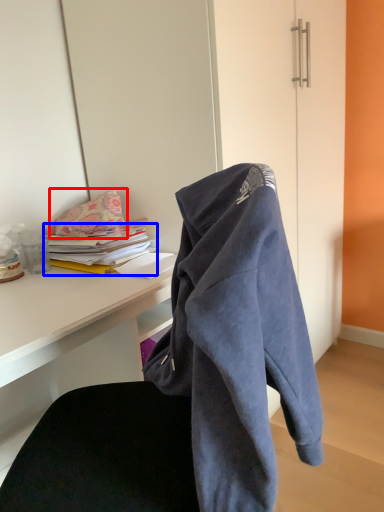
Question: Among these objects, which one is nearest to the camera, pillow (highlighted by a red box) or book (highlighted by a blue box)?

Choices:
 (A) pillow
 (B) book

Answer: (B)